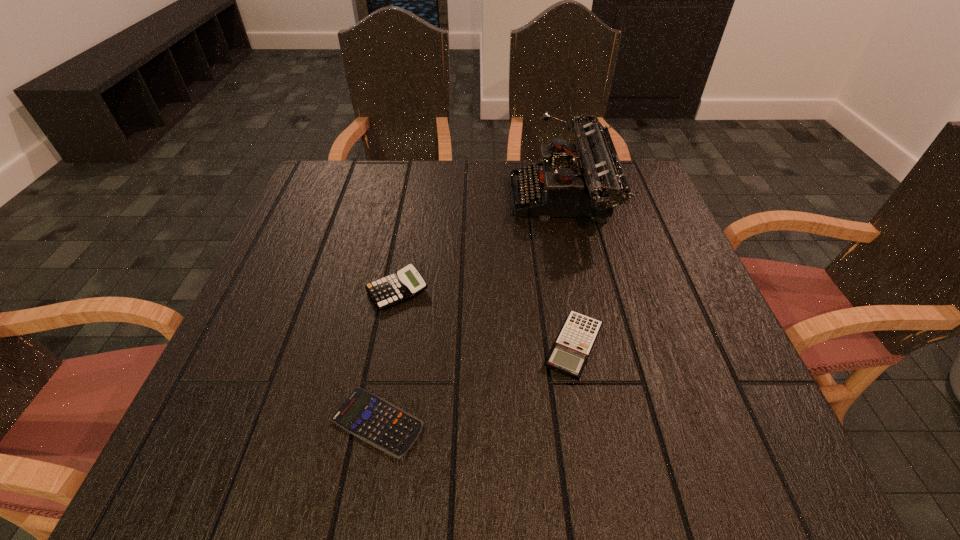
At what (x,y) coordinates should I click in order to perform the action: click on the farthest object. Please return your answer as a coordinate pair (x, y). Image resolution: width=960 pixels, height=540 pixels. Looking at the image, I should click on (590, 182).

Locate an element on the screen. This screenshot has height=540, width=960. typewriter is located at coordinates (590, 182).

At what (x,y) coordinates should I click in order to perform the action: click on the second farthest object. Please return your answer as a coordinate pair (x, y). Image resolution: width=960 pixels, height=540 pixels. Looking at the image, I should click on (406, 283).

You are a GUI agent. You are given a task and a screenshot of the screen. Output one action in this format:
    pyautogui.click(x=<x>, y=<y>)
    Task: Click on the farthest calculator
    Image resolution: width=960 pixels, height=540 pixels.
    Given the screenshot: What is the action you would take?
    pyautogui.click(x=406, y=283)

Where is `the second tallest calculator`? The width and height of the screenshot is (960, 540). the second tallest calculator is located at coordinates (570, 352).

Identify the location of the rightmost calculator. Image resolution: width=960 pixels, height=540 pixels. (570, 352).

Identify the location of the nearest calculator. The image size is (960, 540). (374, 420).

Identify the location of the shortest calculator. This screenshot has height=540, width=960. (374, 420).

This screenshot has width=960, height=540. I want to click on vacant space located on the keyboard of the typewriter, so tap(364, 200).

You are a GUI agent. You are given a task and a screenshot of the screen. Output one action in this format:
    pyautogui.click(x=<x>, y=<y>)
    Task: Click on the vacant space located 0.190m on the keyboard of the typewriter
    This screenshot has height=540, width=960.
    Given the screenshot: What is the action you would take?
    pyautogui.click(x=437, y=200)